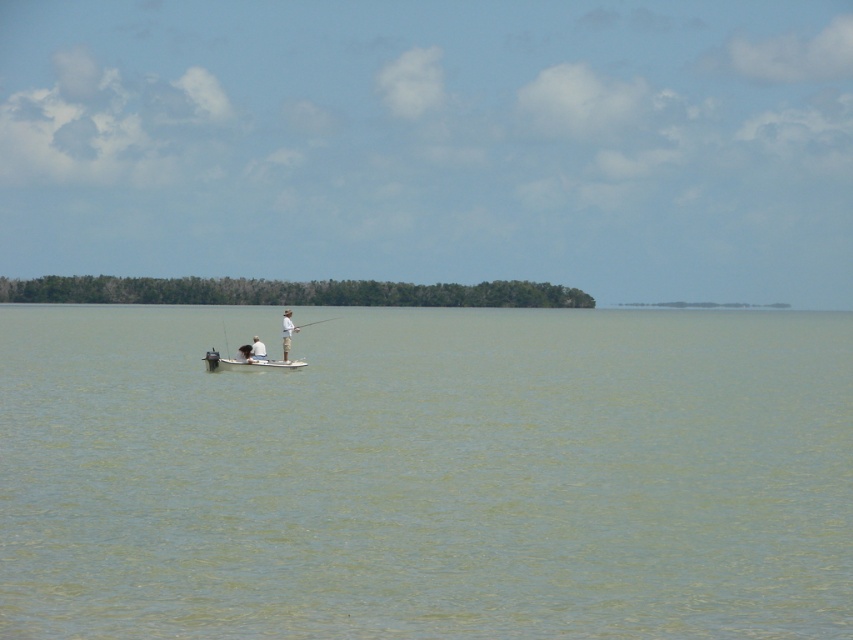
Between white plastic boat at center and white matte shirt at center, which one is positioned higher?

white matte shirt at center is above.

Looking at this image, can you confirm if white plastic boat at center is shorter than white matte shirt at center?

Correct, white plastic boat at center is not as tall as white matte shirt at center.

Is point (305, 364) less distant than point (292, 328)?

No, (305, 364) is behind (292, 328).

I want to click on white plastic boat at center, so click(247, 362).

Does greenish water at center have a smaller size compared to white plastic boat at center?

Actually, greenish water at center might be larger than white plastic boat at center.

Can you confirm if greenish water at center is positioned to the right of white plastic boat at center?

Indeed, greenish water at center is positioned on the right side of white plastic boat at center.

Is point (16, 490) positioned before point (210, 369)?

Yes, point (16, 490) is closer to viewer.

You are a GUI agent. You are given a task and a screenshot of the screen. Output one action in this format:
    pyautogui.click(x=<x>, y=<y>)
    Task: Click on the greenish water at center
    
    Given the screenshot: What is the action you would take?
    pyautogui.click(x=425, y=474)

Can you confirm if greenish water at center is smaller than white plastic fishing rod at center?

No, greenish water at center is not smaller than white plastic fishing rod at center.

Between point (390, 378) and point (299, 328), which one is positioned in front?

Point (299, 328) is in front.

Is point (751, 632) positioned before point (329, 317)?

Yes.

What are the coordinates of `greenish water at center` in the screenshot? It's located at (425, 474).